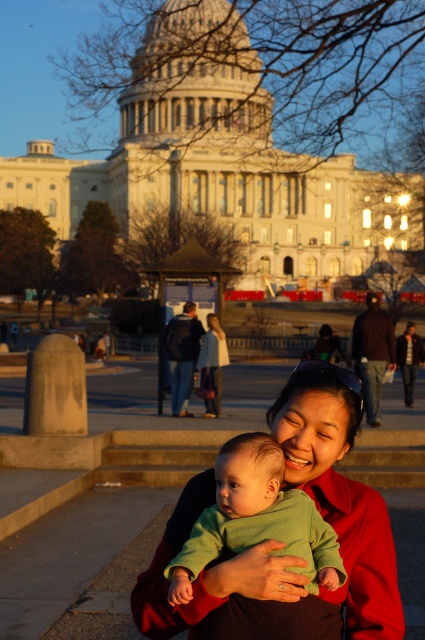
You are a photographer taking a picture of the matte green sweater at center and the green soft baby at center in front of the Capitol Building. Which object should you focus on first if you want to ensure both are in sharp focus?

You should focus on the matte green sweater at center first because it is much taller than the green soft baby at center, so focusing on the taller object will help ensure both are in focus.

You are standing at the point marked by the coordinates point (280, 545) in the image. What object is located at this point?

The point (280, 545) marks the matte green sweater at center.

You are a photographer capturing a family moment in the plaza near the historic building. You notice the matte green sweater at center and the green soft baby at center. Which object is positioned to the right of the other?

The matte green sweater at center is to the right of the green soft baby at center.